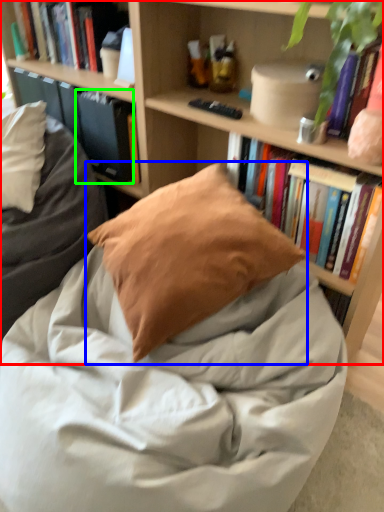
Question: Which object is positioned closest to bookcase (highlighted by a red box)? Select from pillow (highlighted by a blue box) and paperback book (highlighted by a green box).

Choices:
 (A) pillow
 (B) paperback book

Answer: (B)